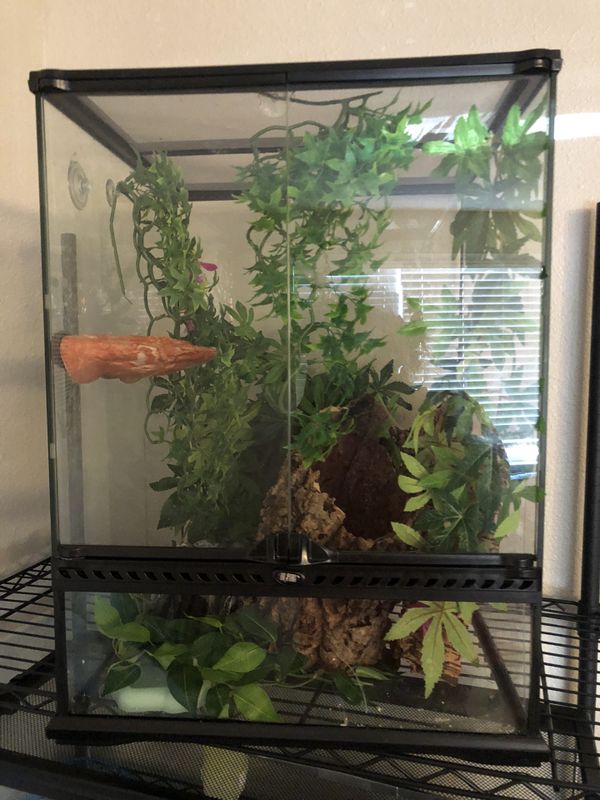
Identify the location of white wall. This screenshot has width=600, height=800. (14, 457), (566, 517).